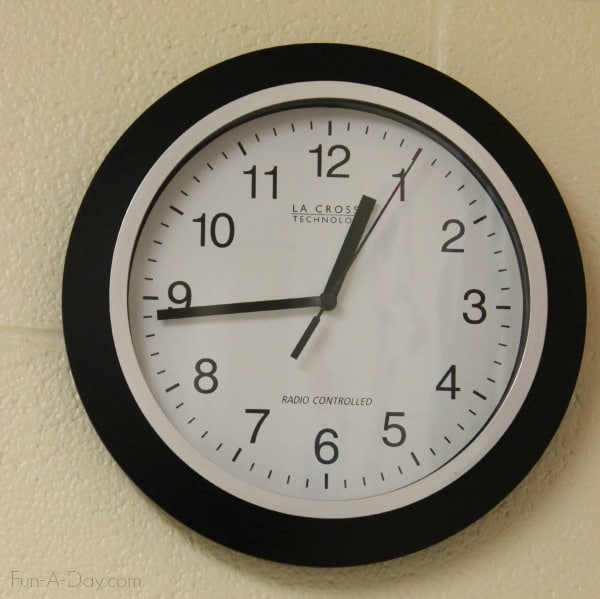
Find the location of a particular element. The image size is (600, 599). empty space on the wall to the upper left is located at coordinates (103, 71).